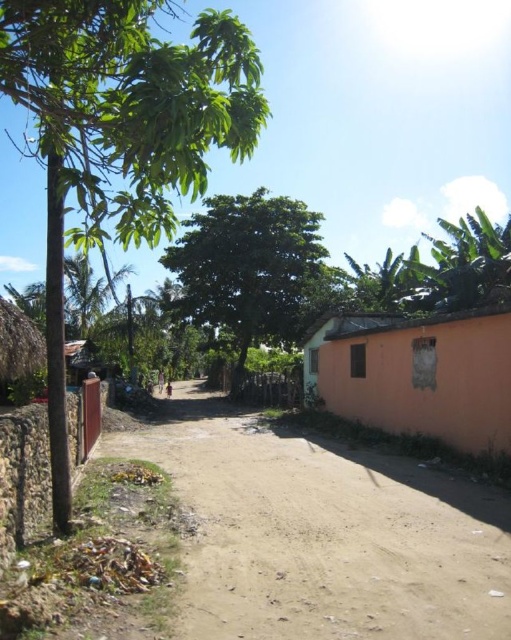
You are a hiker who wants to walk along the brown sandy dirt track at center. Is the green leafy tree at left providing shade over the track? Please explain based on the scene description.

The brown sandy dirt track at center is positioned under the green leafy tree at left, so yes, the tree is casting shade over the track.

You are a hiker planning to walk along the brown sandy dirt track at center and pass by the green leafy tree at left. Considering their sizes, which one do you think will occupy more space in your field of view as you walk towards them?

The green leafy tree at left will occupy more space in your field of view because it is larger than the brown sandy dirt track at center.

You are a hiker who wants to take a photo of both the brown sandy dirt track at center and the green leafy tree at center. Which object should you focus on first if you want to capture both in a single frame without moving the camera?

The brown sandy dirt track at center is smaller than the green leafy tree at center, so you should focus on the green leafy tree at center first to ensure it fits within the frame before adjusting for the smaller object.